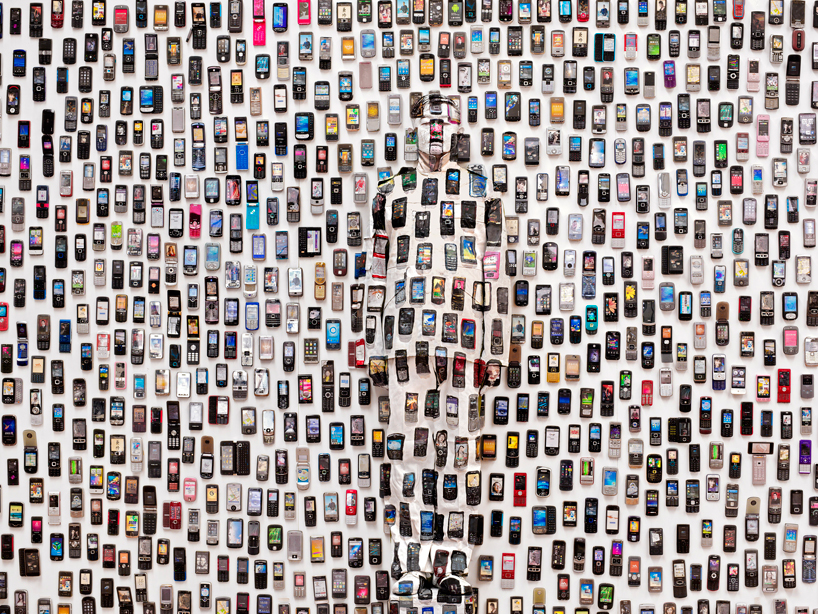
Image resolution: width=818 pixels, height=614 pixels. I want to click on phone, so click(636, 569).